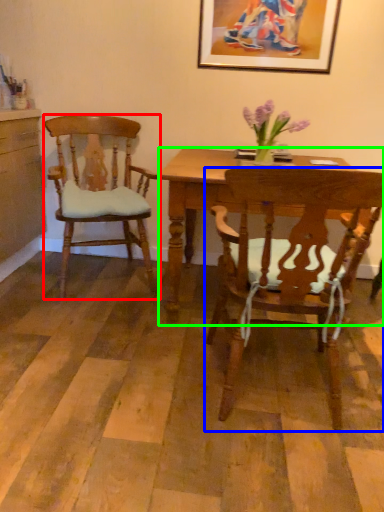
Question: Based on their relative distances, which object is nearer to chair (highlighted by a red box)? Choose from chair (highlighted by a blue box) and desk (highlighted by a green box).

Choices:
 (A) chair
 (B) desk

Answer: (B)